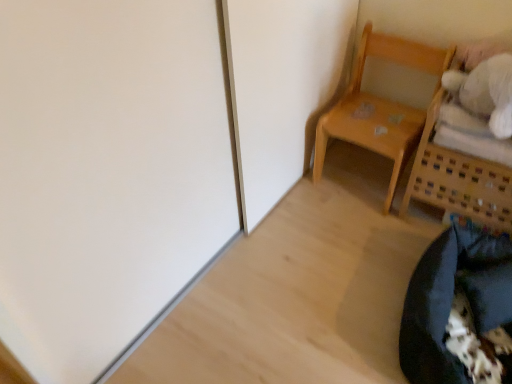
Question: Considering the positions of wooden basket at upper right, the 2th furniture positioned from the left, and black fabric bean bag chair at lower right in the image, is wooden basket at upper right, the 2th furniture positioned from the left, bigger or smaller than black fabric bean bag chair at lower right?

Choices:
 (A) big
 (B) small

Answer: (A)

Question: Is wooden basket at upper right, the 2th furniture positioned from the left, spatially inside black fabric bean bag chair at lower right, or outside of it?

Choices:
 (A) inside
 (B) outside

Answer: (B)

Question: Estimate the real-world distances between objects in this image. Which object is farther from the wooden basket at upper right, which is counted as the 1th furniture, starting from the right?

Choices:
 (A) light wood chair at upper right, the first furniture when ordered from left to right
 (B) black fabric bean bag chair at lower right

Answer: (B)

Question: Which of these objects is positioned closest to the black fabric bean bag chair at lower right?

Choices:
 (A) wooden basket at upper right, which is counted as the 1th furniture, starting from the right
 (B) light wood chair at upper right, which is the second furniture in right-to-left order

Answer: (A)